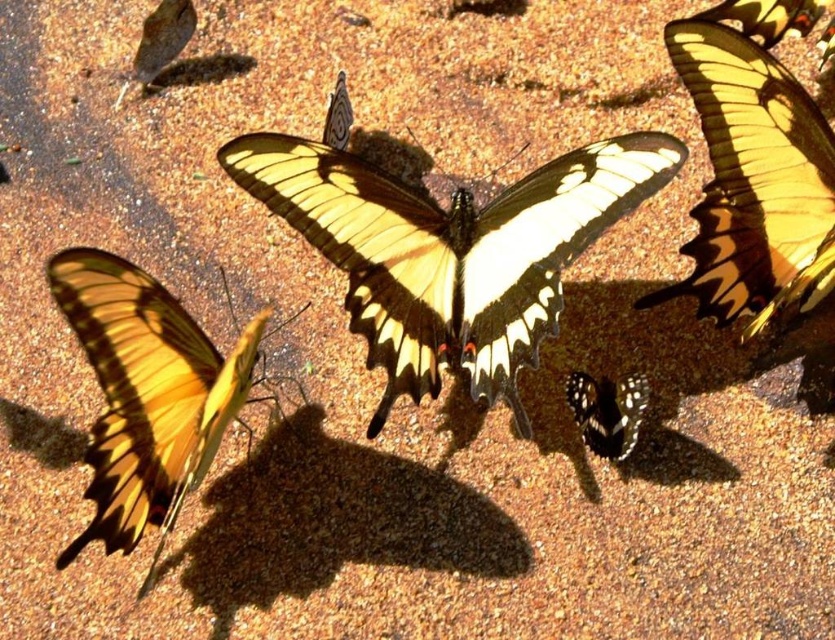
You are a photographer trying to capture the butterflies in the scene. You want to ensure that both the yellow and black winged butterfly at upper right and the black glossy butterfly at lower right are in focus. Given their positions, which butterfly should you focus on first to ensure both are sharp?

The yellow and black winged butterfly at upper right is much taller than the black glossy butterfly at lower right. To ensure both are in focus, you should focus on the taller butterfly first, as it is further away and requires a greater depth of field.

You are a photographer trying to capture the butterfly at point (692,54) and the one at point (778,29). Which butterfly will appear larger in your photo?

The butterfly at point (692,54) will appear larger in the photo because it is closer to the camera than the butterfly at point (778,29).

Based on the photo, you are an entomologist observing the butterflies. Which butterfly is positioned higher in the image, the yellow and black butterfly at center or the yellow matte butterfly at left?

The yellow and black butterfly at center is positioned higher than the yellow matte butterfly at left.